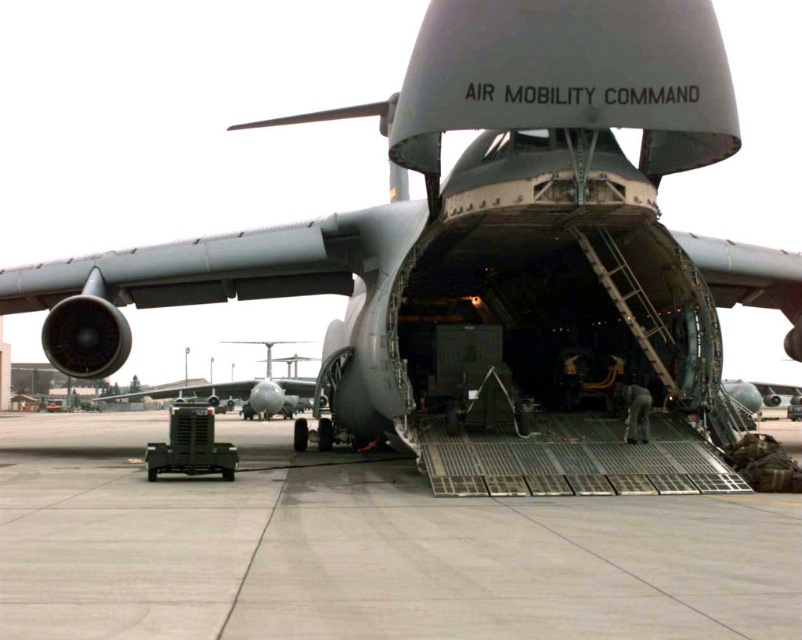
Question: Which point appears farthest from the camera in this image?

Choices:
 (A) (270, 404)
 (B) (442, 538)

Answer: (A)

Question: Can you confirm if gray concrete tarmac at center is positioned to the left of metallic gray aircraft at center?

Choices:
 (A) no
 (B) yes

Answer: (A)

Question: Is gray concrete tarmac at center smaller than metallic gray aircraft at center?

Choices:
 (A) yes
 (B) no

Answer: (A)

Question: Does gray concrete tarmac at center have a greater width compared to metallic gray aircraft at center?

Choices:
 (A) yes
 (B) no

Answer: (B)